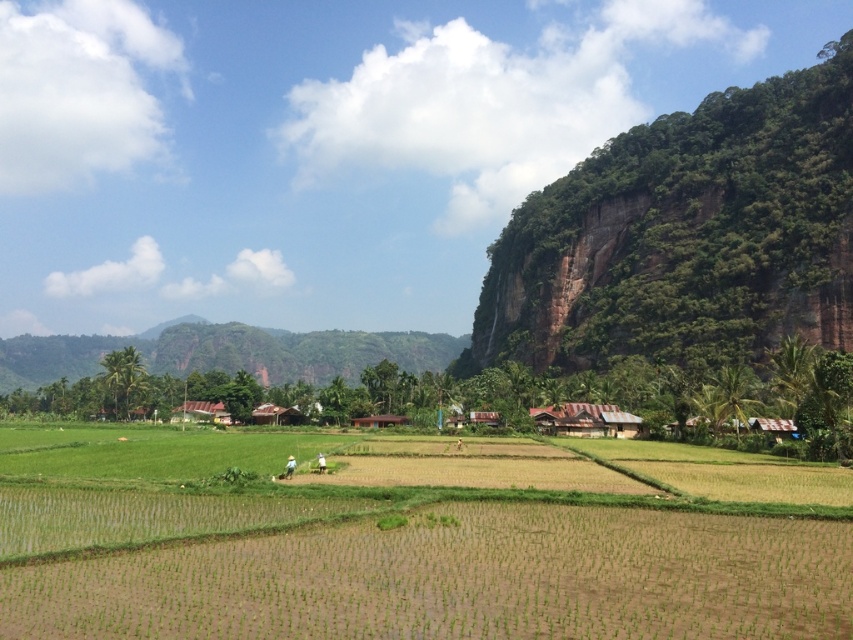
You are standing in the middle of the rice paddies and see two points in the distance. The first point is at coordinates point (431, 460) and the second is at point (730, 310). Which point is closer to you?

Point (431, 460) is closer to the viewer than point (730, 310).

Based on the scene description, where is the green grassy field at center located in the image?

The green grassy field at center is located at the point with coordinates (x=409, y=568) in the image.

You are a hiker planning to take a photo of the green textured cliff at upper right and the green grassy hillside at center. Which object should you focus on first to ensure both are in the frame without moving the camera?

You should focus on the green textured cliff at upper right first because it is in front of the green grassy hillside at center, so keeping it in focus will help both appear sharp in the photo.